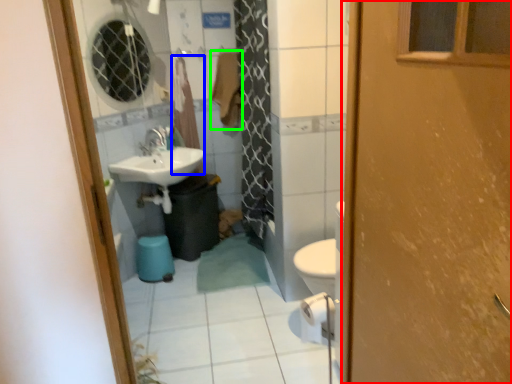
Question: Which is nearer to the door (highlighted by a red box)? curtain (highlighted by a blue box) or laundry (highlighted by a green box).

Choices:
 (A) curtain
 (B) laundry

Answer: (B)